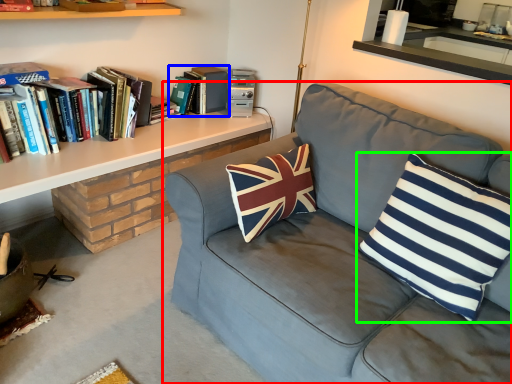
Question: Which is nearer to the studio couch (highlighted by a red box)? book (highlighted by a blue box) or pillow (highlighted by a green box).

Choices:
 (A) book
 (B) pillow

Answer: (B)